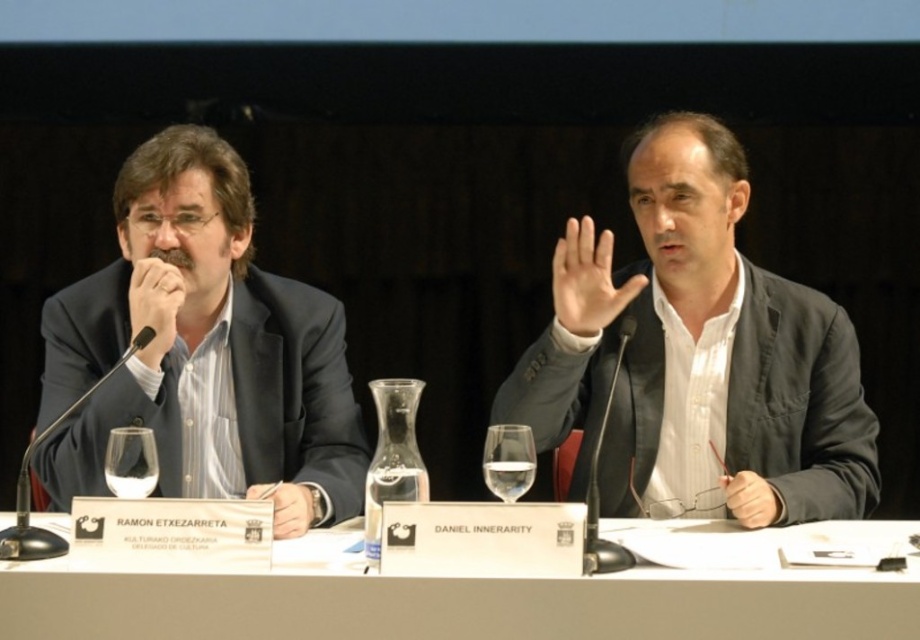
Question: Can you confirm if white paper at center is wider than matte black hand at center?

Choices:
 (A) yes
 (B) no

Answer: (A)

Question: Which is farther from the transparent glass carafe at center?

Choices:
 (A) matte black suit at left
 (B) clear glass at center

Answer: (A)

Question: Is transparent glass carafe at center bigger than clear glass at center?

Choices:
 (A) yes
 (B) no

Answer: (A)

Question: Which point appears farthest from the camera in this image?

Choices:
 (A) (118, 490)
 (B) (368, 470)

Answer: (B)

Question: Which point is farther to the camera?

Choices:
 (A) matte gray suit at right
 (B) clear glass wine glass at center
 (C) matte black pen at center

Answer: (A)

Question: Can you confirm if matte black hand at center is positioned above matte black hand at left?

Choices:
 (A) yes
 (B) no

Answer: (A)